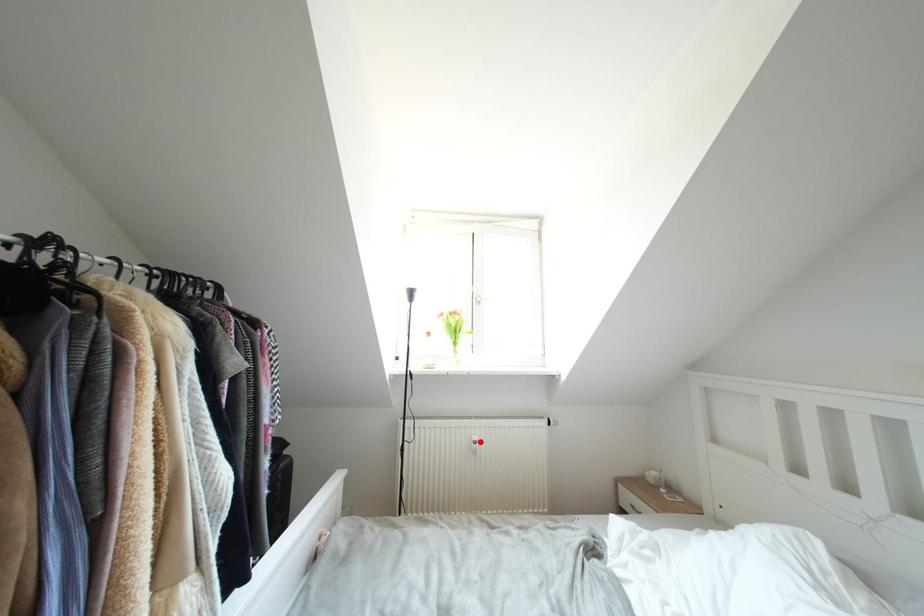
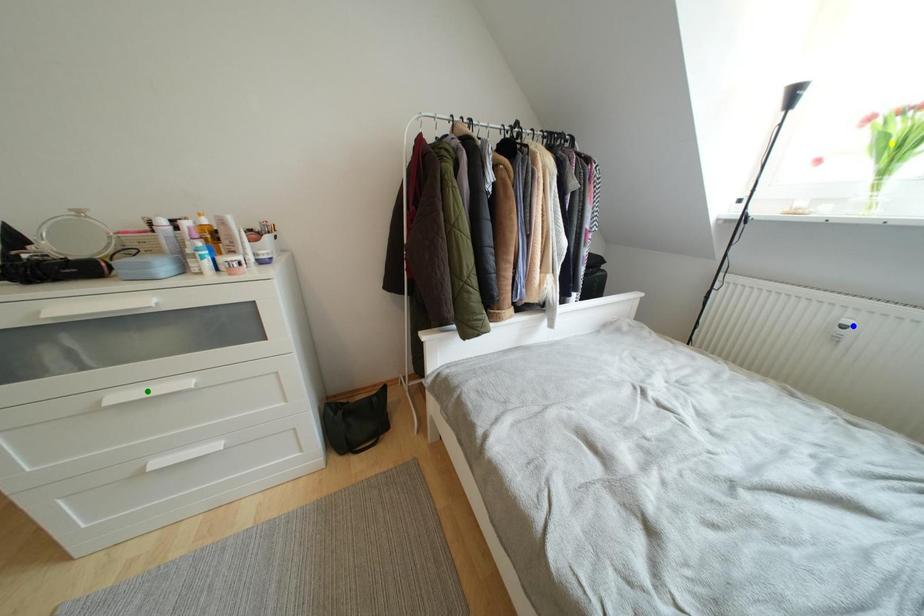
Question: I am providing you with two images of the same scene from different viewpoints. A red point is marked on the first image. You are given multiple points on the second image. Which spot in image 2 lines up with the point in image 1?

Choices:
 (A) green point
 (B) yellow point
 (C) blue point

Answer: (C)